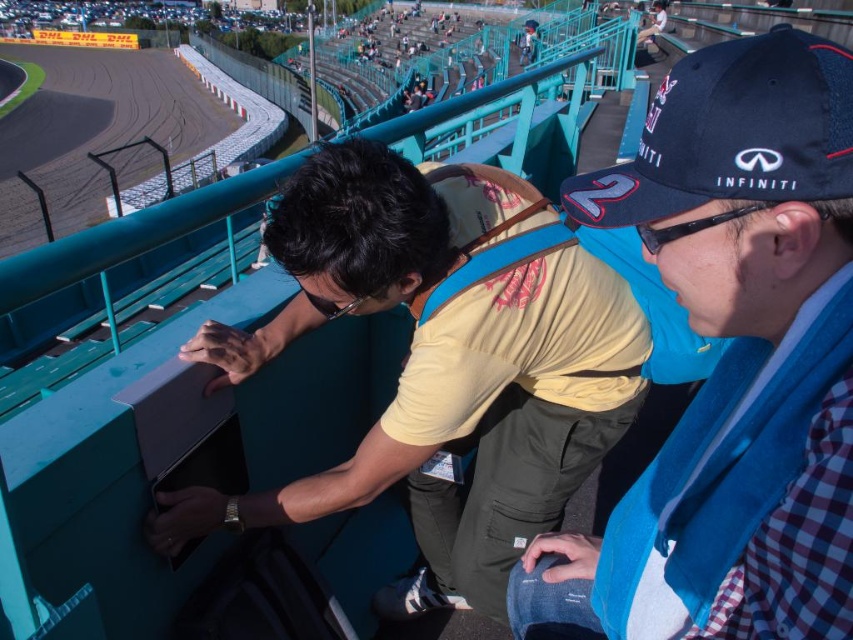
Question: Can you confirm if blue fabric scarf at center-right is wider than navy blue mesh baseball cap at upper right?

Choices:
 (A) yes
 (B) no

Answer: (A)

Question: Which point is farther to the camera?

Choices:
 (A) navy blue mesh baseball cap at upper right
 (B) blue fabric scarf at center-right

Answer: (A)

Question: Can you confirm if blue fabric scarf at center-right is positioned to the right of navy blue mesh baseball cap at upper right?

Choices:
 (A) no
 (B) yes

Answer: (B)

Question: Considering the relative positions of blue fabric scarf at center-right and navy blue mesh baseball cap at upper right in the image provided, where is blue fabric scarf at center-right located with respect to navy blue mesh baseball cap at upper right?

Choices:
 (A) left
 (B) right

Answer: (B)